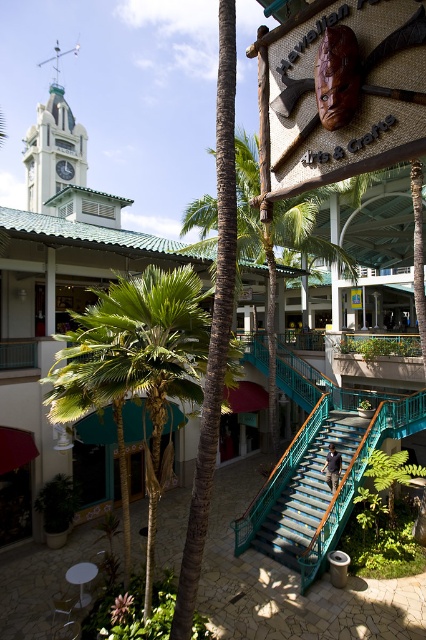
You are an architect designing a new building and want to incorporate elements from this scene. If you want to ensure the green painted metal clock tower at upper left and the metallic clock at upper left are visible from the entrance, which one should you place closer to the entrance?

The metallic clock at upper left should be placed closer to the entrance because if the green painted metal clock tower at upper left is wider, it would naturally appear larger and dominate the view, making the smaller metallic clock at upper left more visible when positioned nearer to ensure both are seen clearly.

You are standing at point (57, 42) and want to walk to the clock tower in the background. Which direction should you move relative to point (63, 413)?

You should move towards point (63, 413) because it is in front of point (57, 42), meaning it is closer to the clock tower in the background.